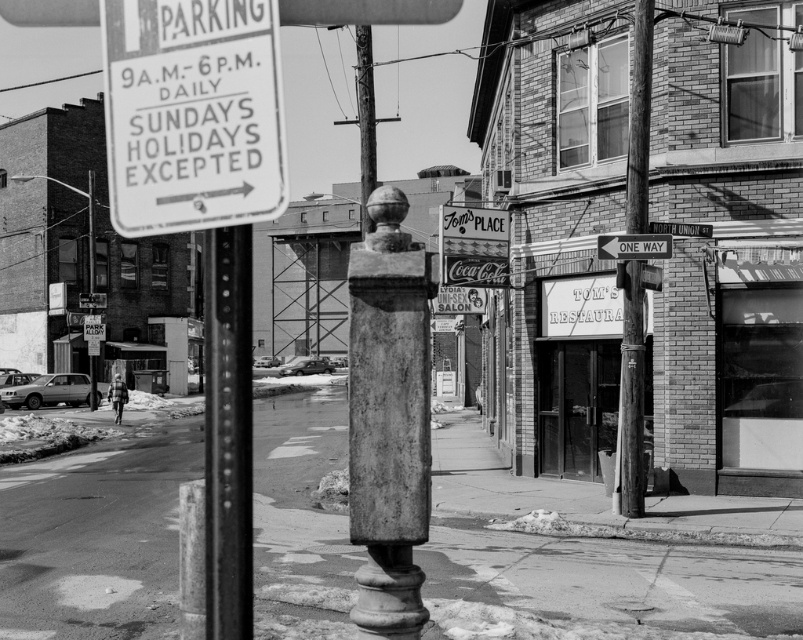
Can you confirm if wooden pole at center-right is positioned to the right of white paper street sign at upper center?

Incorrect, wooden pole at center-right is not on the right side of white paper street sign at upper center.

Is wooden pole at center-right thinner than white paper street sign at upper center?

Correct, wooden pole at center-right's width is less than white paper street sign at upper center's.

Between point (632, 493) and point (679, 227), which one is positioned behind?

Positioned behind is point (679, 227).

You are a GUI agent. You are given a task and a screenshot of the screen. Output one action in this format:
    pyautogui.click(x=<x>, y=<y>)
    Task: Click on the wooden pole at center-right
    This screenshot has height=640, width=803.
    Given the screenshot: What is the action you would take?
    pyautogui.click(x=632, y=394)

Which of these two, white paper sign at upper left or metallic one way sign at center, stands shorter?

metallic one way sign at center is shorter.

Is point (214, 19) positioned before point (663, 243)?

That is True.

Measure the distance between point (170, 1) and camera.

Point (170, 1) and camera are 2.83 meters apart from each other.

Find the location of a particular element. white paper sign at upper left is located at coordinates (192, 113).

Can you confirm if white paper sign at upper left is shorter than white paper street sign at upper center?

No, white paper sign at upper left is not shorter than white paper street sign at upper center.

Looking at this image, which of these two, white paper sign at upper left or white paper street sign at upper center, stands shorter?

white paper street sign at upper center

This screenshot has height=640, width=803. What are the coordinates of `white paper sign at upper left` in the screenshot? It's located at (192, 113).

The height and width of the screenshot is (640, 803). Identify the location of white paper sign at upper left. (192, 113).